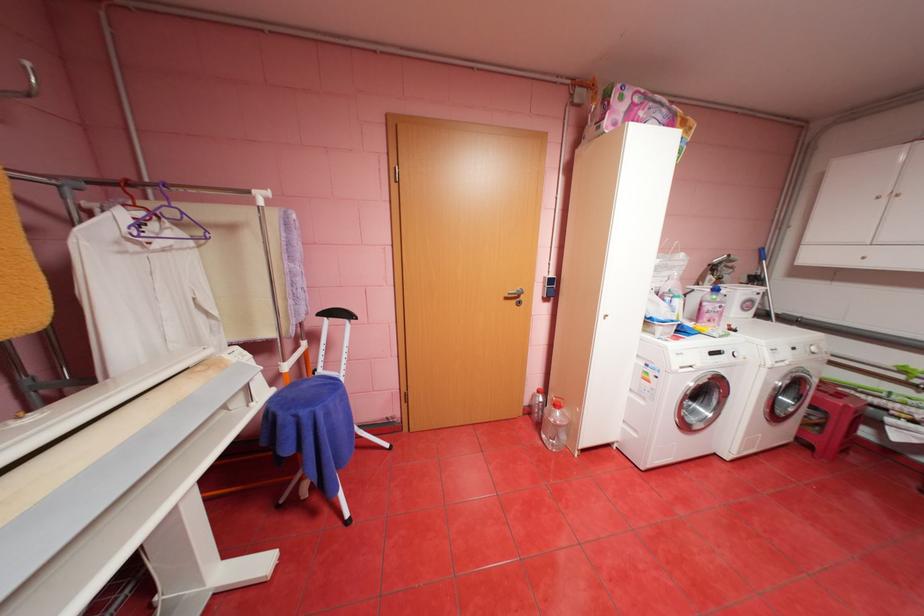
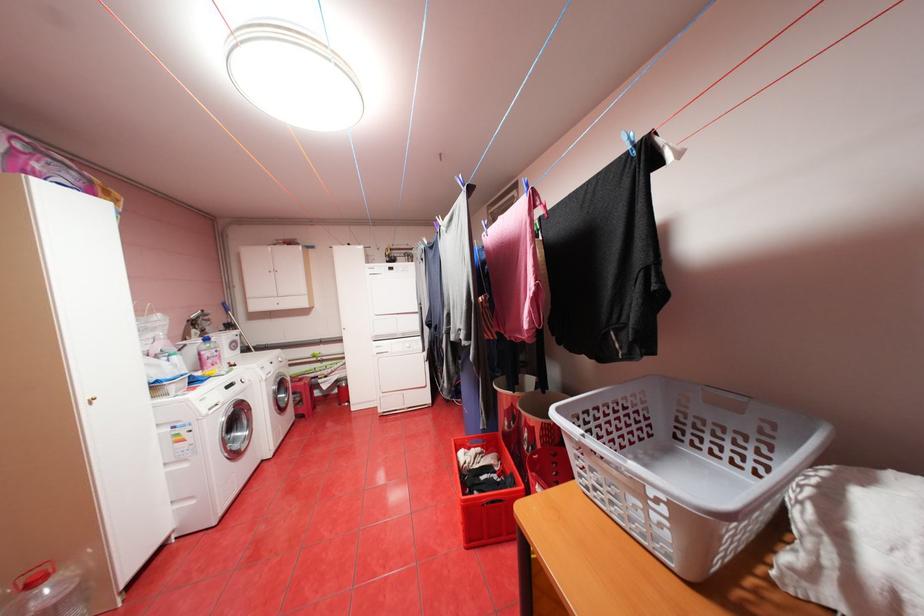
Find the pixel in the second image that matches point 700,419 in the first image.

(245, 446)